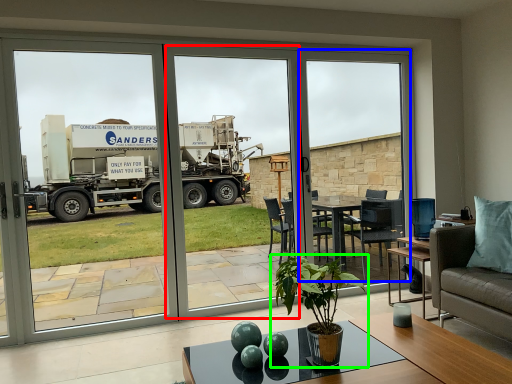
Question: Which is farther away from screen door (highlighted by a red box)? window screen (highlighted by a blue box) or houseplant (highlighted by a green box)?

Choices:
 (A) window screen
 (B) houseplant

Answer: (B)